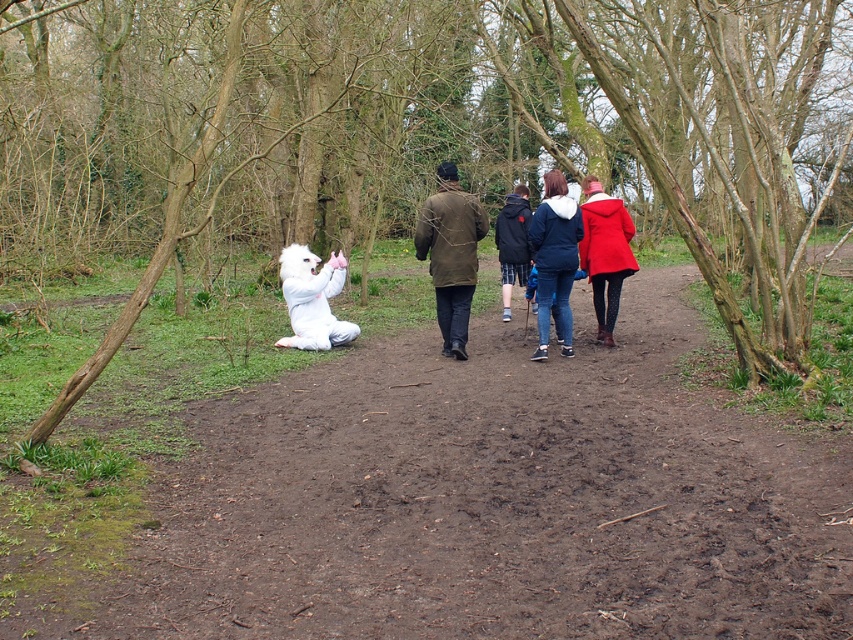
Between brown bark tree at lower left and denim jacket at center, which one appears on the left side from the viewer's perspective?

Positioned to the left is brown bark tree at lower left.

Can you confirm if brown bark tree at lower left is positioned to the left of denim jacket at center?

Yes, brown bark tree at lower left is to the left of denim jacket at center.

Identify the location of brown bark tree at lower left. pyautogui.click(x=422, y=131).

Can you confirm if red woolen coat at center is taller than dark blue denim jacket at center?

Yes, red woolen coat at center is taller than dark blue denim jacket at center.

Who is more forward, (595, 216) or (532, 307)?

Point (595, 216)

Who is more distant from viewer, (x=619, y=248) or (x=527, y=214)?

Point (x=527, y=214)

Image resolution: width=853 pixels, height=640 pixels. I want to click on red woolen coat at center, so click(605, 253).

Based on the photo, who is shorter, brown bark tree at lower left or white plush at center?

white plush at center is shorter.

Does brown bark tree at lower left lie in front of white plush at center?

Yes, it is in front of white plush at center.

Does point (161, 164) lie behind point (299, 285)?

Yes, point (161, 164) is behind point (299, 285).

You are a GUI agent. You are given a task and a screenshot of the screen. Output one action in this format:
    pyautogui.click(x=<x>, y=<y>)
    Task: Click on the brown bark tree at lower left
    Image resolution: width=853 pixels, height=640 pixels.
    Given the screenshot: What is the action you would take?
    pyautogui.click(x=422, y=131)